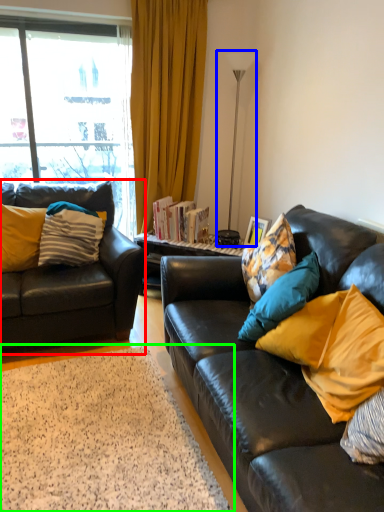
Question: Based on their relative distances, which object is farther from studio couch (highlighted by a red box)? Choose from lamp (highlighted by a blue box) and flat (highlighted by a green box).

Choices:
 (A) lamp
 (B) flat

Answer: (A)